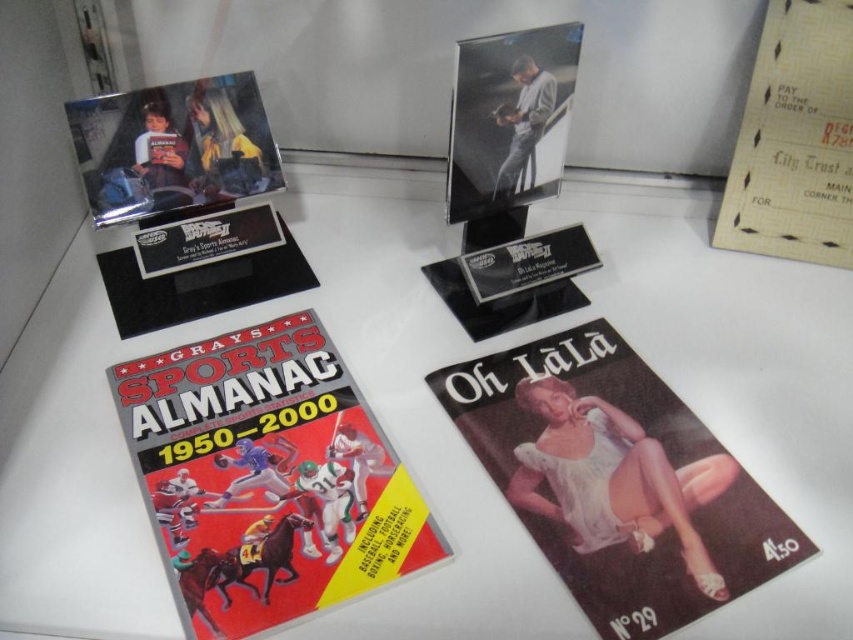
Question: Does white glossy table at center appear under matte black photo frame at center?

Choices:
 (A) no
 (B) yes

Answer: (B)

Question: Can you confirm if white glossy table at center is smaller than matte white magazine at lower right?

Choices:
 (A) yes
 (B) no

Answer: (B)

Question: In this image, where is white glossy table at center located relative to multicolored paper sports almanac at lower left?

Choices:
 (A) left
 (B) right

Answer: (B)

Question: Among these points, which one is nearest to the camera?

Choices:
 (A) (241, 358)
 (B) (607, 328)
 (C) (534, 76)

Answer: (C)

Question: Which object is the farthest from the multicolored paper sports almanac at lower left?

Choices:
 (A) white glossy table at center
 (B) yellow paper check at upper right
 (C) matte black photo frame at center
 (D) matte plastic photo at upper left

Answer: (B)

Question: Which point is closer to the camera taking this photo?

Choices:
 (A) (813, 241)
 (B) (752, 556)

Answer: (B)